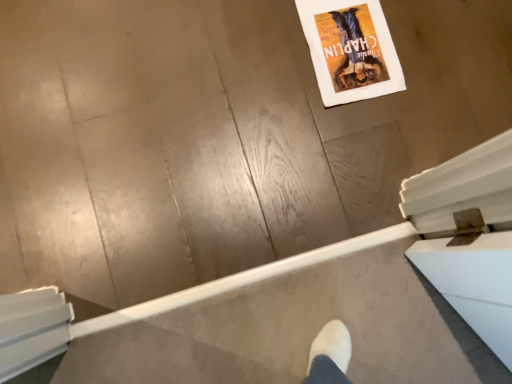
Describe the element at coordinates (350, 49) in the screenshot. I see `white paper towel at upper center` at that location.

Identify the location of white paper towel at upper center. (350, 49).

Where is `white paper towel at upper center`? The image size is (512, 384). white paper towel at upper center is located at coordinates (350, 49).